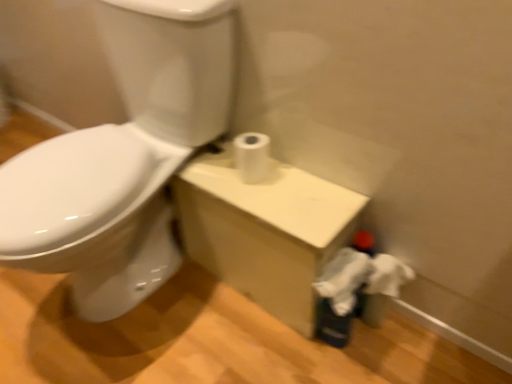
Locate an element on the screen. Image resolution: width=512 pixels, height=384 pixels. vacant area situated to the left side of white matte toilet paper at center is located at coordinates click(215, 166).